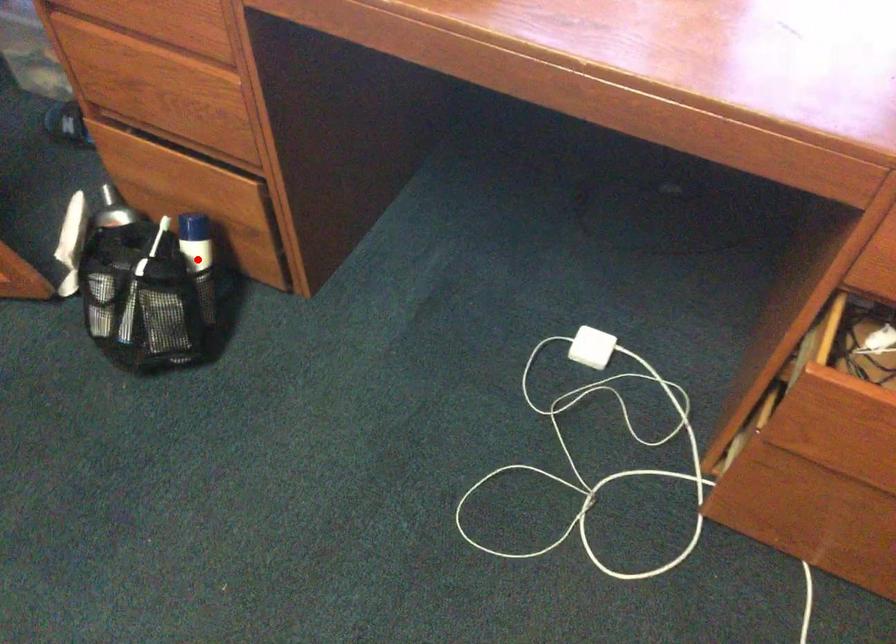
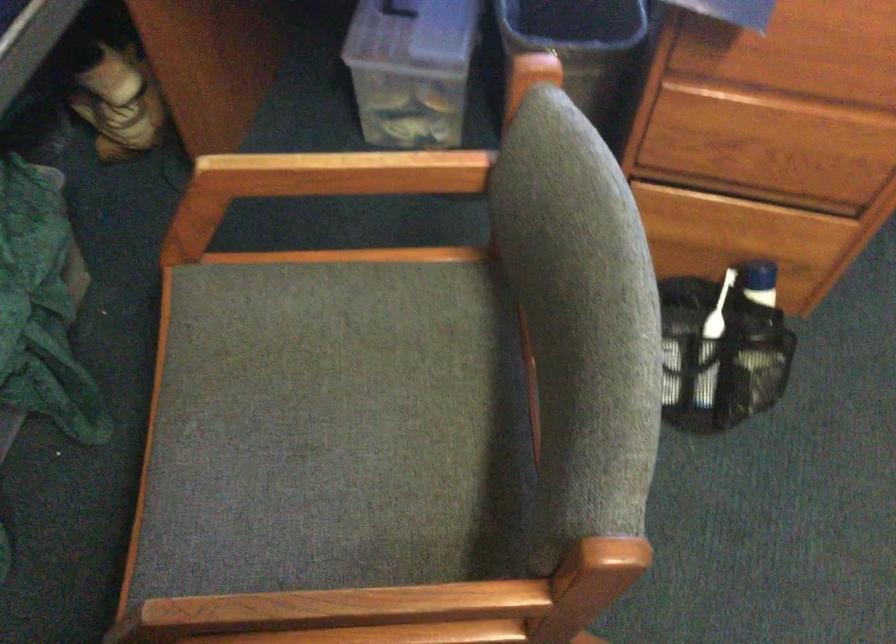
In the second image, find the point that corresponds to the highlighted location in the first image.

(757, 303)